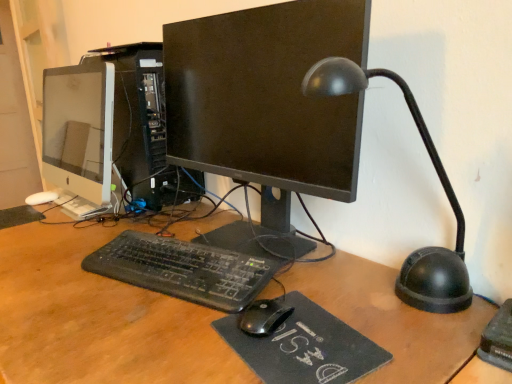
Question: From the image's perspective, is black matte monitor at center, which appears as the 2th computer monitor when viewed from the left, on top of black plastic keyboard at center?

Choices:
 (A) no
 (B) yes

Answer: (B)

Question: Is black matte monitor at center, which is counted as the 1th computer monitor, starting from the right, next to black plastic keyboard at center and touching it?

Choices:
 (A) no
 (B) yes

Answer: (A)

Question: Considering the relative sizes of black matte monitor at center, which appears as the 2th computer monitor when viewed from the left, and black plastic keyboard at center in the image provided, is black matte monitor at center, which appears as the 2th computer monitor when viewed from the left, thinner than black plastic keyboard at center?

Choices:
 (A) yes
 (B) no

Answer: (B)

Question: Is black plastic keyboard at center completely or partially inside black matte monitor at center, which is counted as the 1th computer monitor, starting from the right?

Choices:
 (A) no
 (B) yes

Answer: (A)

Question: From the image's perspective, is black matte monitor at center, which appears as the 2th computer monitor when viewed from the left, beneath black plastic keyboard at center?

Choices:
 (A) no
 (B) yes

Answer: (A)

Question: Is black matte monitor at center, which appears as the 2th computer monitor when viewed from the left, shorter than black plastic keyboard at center?

Choices:
 (A) no
 (B) yes

Answer: (A)

Question: Is black felt mousepad at center positioned in front of white glossy monitor at left, the first computer monitor in the left-to-right sequence?

Choices:
 (A) no
 (B) yes

Answer: (B)

Question: Does black felt mousepad at center touch white glossy monitor at left, acting as the second computer monitor starting from the right?

Choices:
 (A) yes
 (B) no

Answer: (B)

Question: Is black felt mousepad at center not inside white glossy monitor at left, acting as the second computer monitor starting from the right?

Choices:
 (A) yes
 (B) no

Answer: (A)

Question: Does black felt mousepad at center have a smaller size compared to white glossy monitor at left, acting as the second computer monitor starting from the right?

Choices:
 (A) no
 (B) yes

Answer: (B)

Question: Are black felt mousepad at center and white glossy monitor at left, the first computer monitor in the left-to-right sequence, located far from each other?

Choices:
 (A) no
 (B) yes

Answer: (A)

Question: Could you tell me if black felt mousepad at center is turned towards white glossy monitor at left, the first computer monitor in the left-to-right sequence?

Choices:
 (A) yes
 (B) no

Answer: (B)

Question: Considering the relative sizes of black matte monitor at center, which is counted as the 1th computer monitor, starting from the right, and black plastic table lamp at right in the image provided, is black matte monitor at center, which is counted as the 1th computer monitor, starting from the right, thinner than black plastic table lamp at right?

Choices:
 (A) yes
 (B) no

Answer: (A)